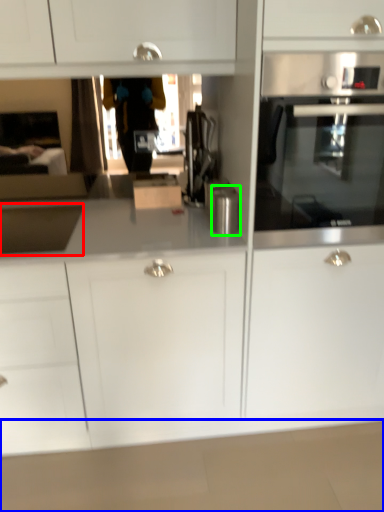
Question: Considering the real-world distances, which object is farthest from sink (highlighted by a red box)? counter top (highlighted by a blue box) or kitchen appliance (highlighted by a green box)?

Choices:
 (A) counter top
 (B) kitchen appliance

Answer: (A)